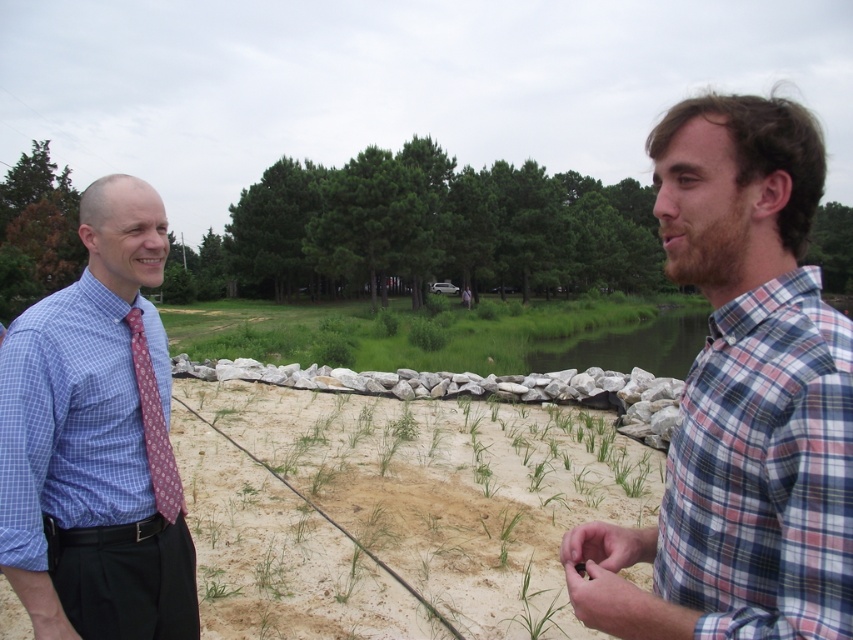
Looking at this image, you are a photographer trying to capture a photo of both the blue checkered shirt at left and the plaid fabric shirt at right. Based on their positions, which shirt should you focus on first to ensure both are in frame?

The blue checkered shirt at left is located above plaid fabric shirt at right, so you should focus on the plaid fabric shirt at right first to ensure both are in frame.

You are a photographer trying to capture both the plaid fabric shirt at right and the maroon printed tie at left in a single frame. Given their sizes, which object should you focus on to ensure both fit clearly in the photo?

Since the plaid fabric shirt at right is bigger than the maroon printed tie at left, you should focus on the plaid fabric shirt at right to ensure both objects fit clearly in the photo.